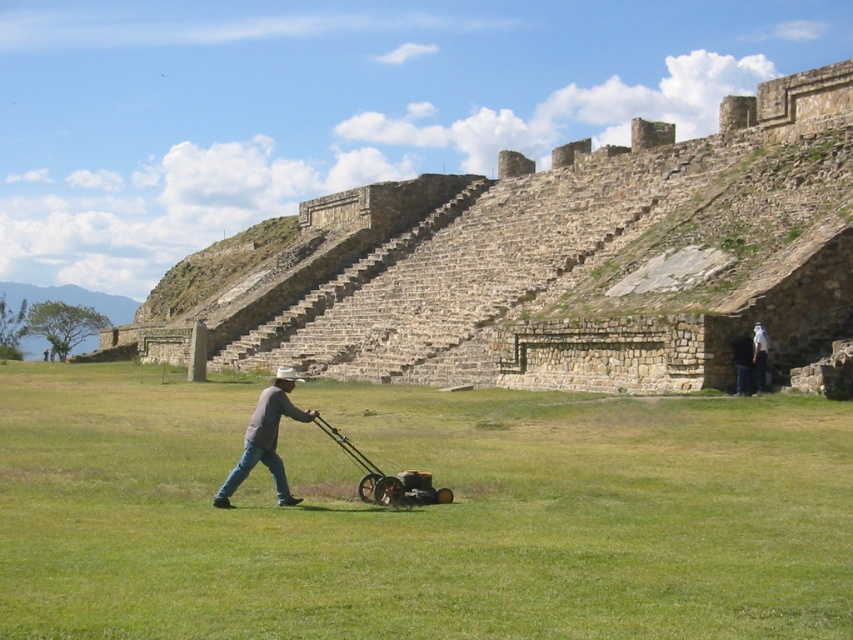
Question: Can you confirm if green grass at center is positioned to the left of white cotton shirt at center?

Choices:
 (A) yes
 (B) no

Answer: (A)

Question: Which point is closer to the camera?

Choices:
 (A) green grass at center
 (B) gray cotton shirt at center
 (C) white cotton shirt at center

Answer: (A)

Question: Can you confirm if green grass at center is wider than stone amphitheater at center?

Choices:
 (A) no
 (B) yes

Answer: (A)

Question: Which object is positioned farthest from the dark gray fabric shirt at lower right?

Choices:
 (A) gray cotton shirt at center
 (B) green grass at center
 (C) stone amphitheater at center

Answer: (C)

Question: Can you confirm if stone amphitheater at center is thinner than yellow metallic mower at center?

Choices:
 (A) no
 (B) yes

Answer: (A)

Question: Which object is farther from the camera taking this photo?

Choices:
 (A) white cotton shirt at center
 (B) stone amphitheater at center
 (C) green grass at center

Answer: (B)